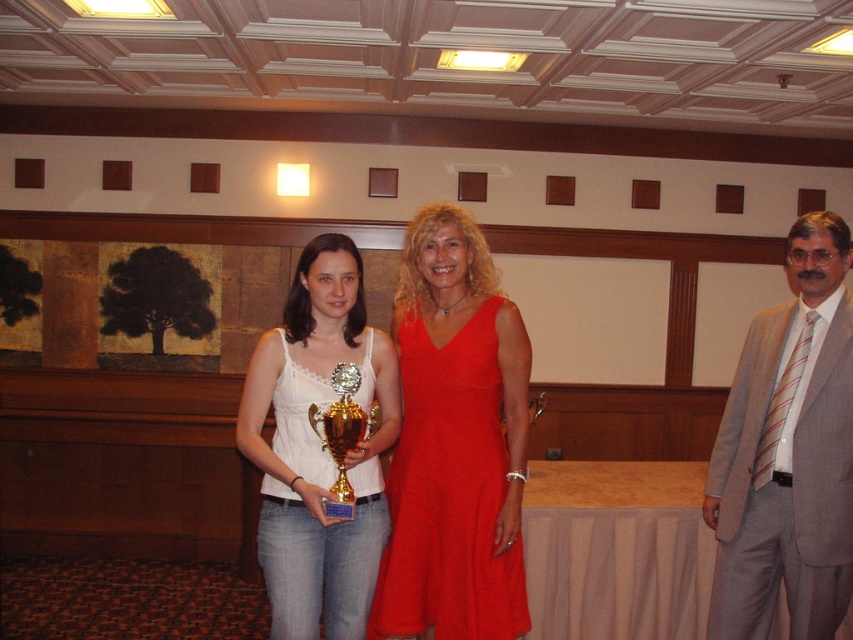
Question: Does white fabric tank top at center come in front of gold shiny trophy at center?

Choices:
 (A) no
 (B) yes

Answer: (A)

Question: Which object is farther from the camera taking this photo?

Choices:
 (A) white fabric tank top at center
 (B) red satin dress at center
 (C) white fabric dress at center

Answer: (B)

Question: Among these points, which one is nearest to the camera?

Choices:
 (A) (471, 600)
 (B) (276, 413)
 (C) (340, 444)
 (D) (718, 632)

Answer: (C)

Question: Among these objects, which one is nearest to the camera?

Choices:
 (A) gray suit at right
 (B) white fabric dress at center
 (C) gold shiny trophy at center

Answer: (C)

Question: Is white fabric dress at center in front of gold shiny trophy at center?

Choices:
 (A) no
 (B) yes

Answer: (A)

Question: From the image, what is the correct spatial relationship of red satin dress at center in relation to gold shiny trophy at center?

Choices:
 (A) right
 (B) left

Answer: (A)